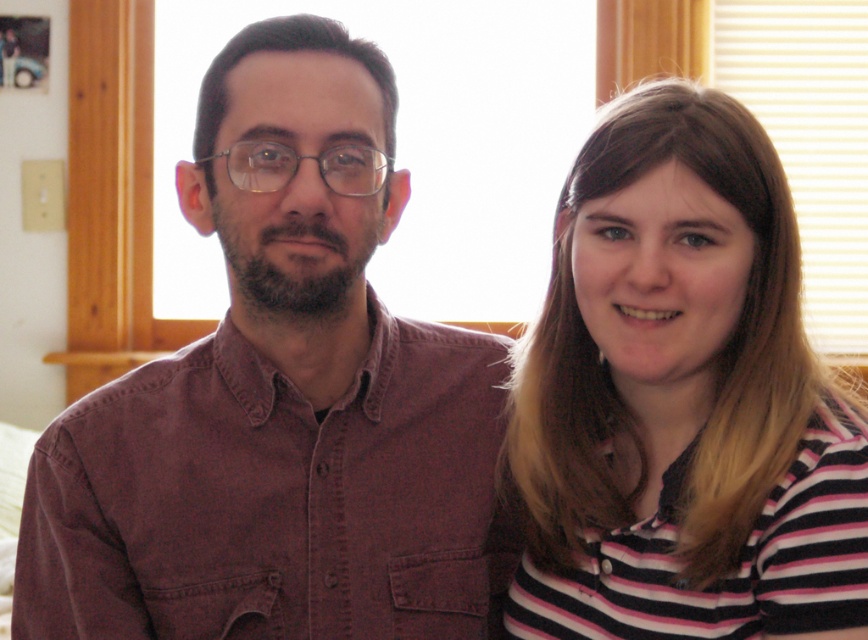
Question: Is matte brown shirt at left wider than pink striped shirt at right?

Choices:
 (A) yes
 (B) no

Answer: (A)

Question: Does pink striped shirt at right lie in front of striped cotton shirt at right?

Choices:
 (A) yes
 (B) no

Answer: (A)

Question: In this image, where is pink striped shirt at right located relative to striped cotton shirt at right?

Choices:
 (A) left
 (B) right

Answer: (B)

Question: Which point is closer to the camera taking this photo?

Choices:
 (A) (235, 282)
 (B) (748, 611)
 (C) (668, 561)

Answer: (B)

Question: Estimate the real-world distances between objects in this image. Which object is closer to the striped cotton shirt at right?

Choices:
 (A) matte brown shirt at left
 (B) pink striped shirt at right

Answer: (B)

Question: Which of these objects is positioned farthest from the pink striped shirt at right?

Choices:
 (A) striped cotton shirt at right
 (B) matte brown shirt at left

Answer: (B)